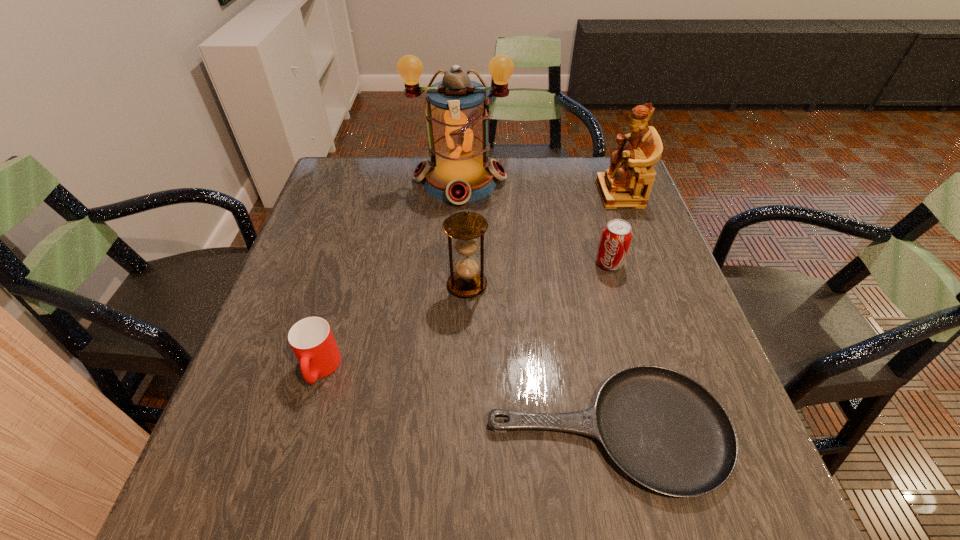
This screenshot has height=540, width=960. I want to click on lantern, so click(457, 113).

The width and height of the screenshot is (960, 540). In order to click on the second tallest object in this screenshot , I will do `click(627, 183)`.

Identify the location of the fourth shortest object. click(x=468, y=280).

Image resolution: width=960 pixels, height=540 pixels. What are the coordinates of `the third shortest object` in the screenshot? It's located at (616, 236).

I want to click on the fifth tallest object, so click(x=311, y=339).

Where is `cup`? The height and width of the screenshot is (540, 960). cup is located at coordinates (311, 339).

Where is `the shortest object`? the shortest object is located at coordinates click(x=665, y=430).

The width and height of the screenshot is (960, 540). What are the coordinates of `blank area located 0.290m on the front-facing side of the tallest object` in the screenshot? It's located at (454, 287).

Locate an element on the screen. This screenshot has width=960, height=540. free space located 0.260m on the front-facing side of the second tallest object is located at coordinates (509, 194).

This screenshot has height=540, width=960. What are the coordinates of `free spot located 0.340m on the front-facing side of the second tallest object` in the screenshot? It's located at (481, 194).